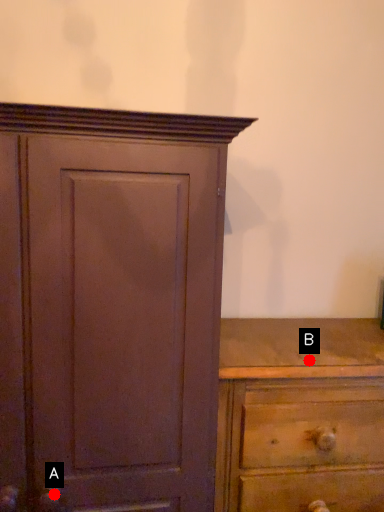
Question: Two points are circled on the image, labeled by A and B beside each circle. Which of the following is the closest to the observer?

Choices:
 (A) A is closer
 (B) B is closer

Answer: (A)